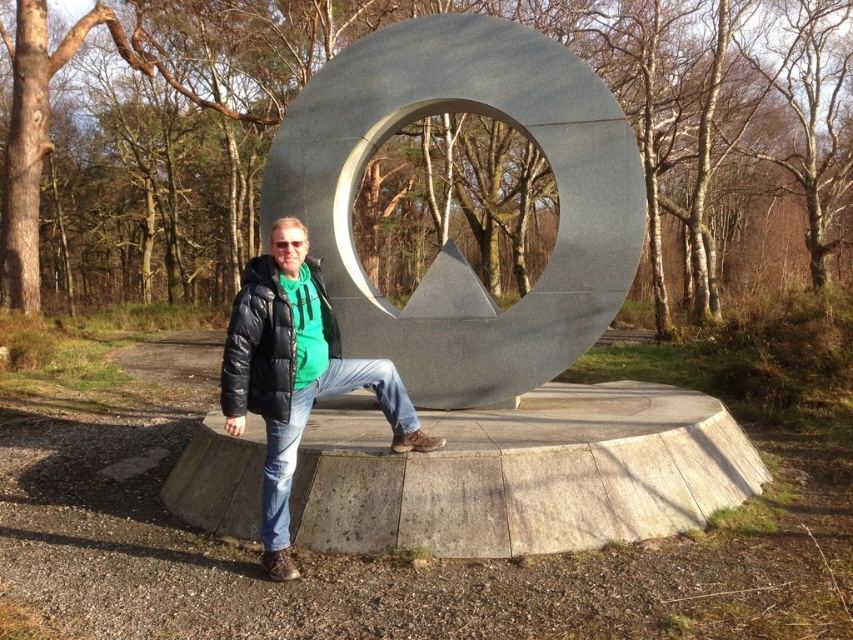
Question: Which of the following is the farthest from the observer?

Choices:
 (A) black puffer jacket at center
 (B) black matte jacket at center
 (C) polished metal circle at center

Answer: (C)

Question: Is black matte jacket at center positioned behind black puffer jacket at center?

Choices:
 (A) yes
 (B) no

Answer: (B)

Question: Can you confirm if polished metal circle at center is positioned to the right of black matte jacket at center?

Choices:
 (A) yes
 (B) no

Answer: (A)

Question: Which is farther from the black matte jacket at center?

Choices:
 (A) black puffer jacket at center
 (B) polished metal circle at center

Answer: (B)

Question: Which point is closer to the camera taking this photo?

Choices:
 (A) (263, 262)
 (B) (225, 401)

Answer: (B)

Question: Can you confirm if polished metal circle at center is wider than black matte jacket at center?

Choices:
 (A) no
 (B) yes

Answer: (B)